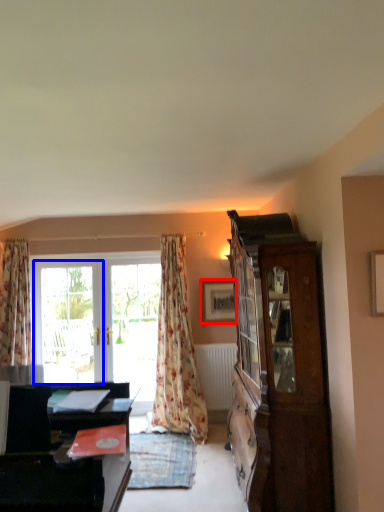
Question: Which of the following is the farthest to the observer, picture frame (highlighted by a red box) or window (highlighted by a blue box)?

Choices:
 (A) picture frame
 (B) window

Answer: (B)